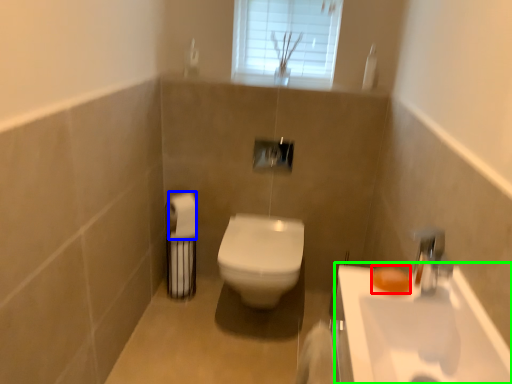
Question: Based on their relative distances, which object is nearer to soap (highlighted by a red box)? Choose from toilet paper (highlighted by a blue box) and sink (highlighted by a green box).

Choices:
 (A) toilet paper
 (B) sink

Answer: (B)